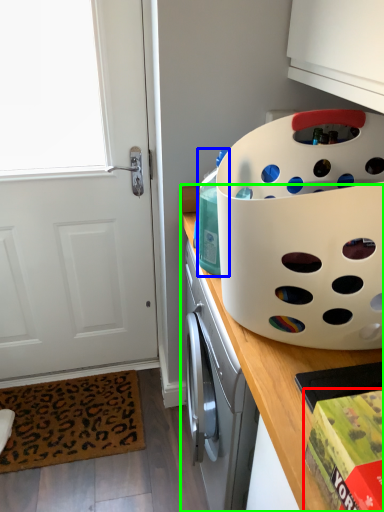
Question: Based on their relative distances, which object is farther from box (highlighted by a red box)? Choose from bottle (highlighted by a blue box) and countertop (highlighted by a green box).

Choices:
 (A) bottle
 (B) countertop

Answer: (A)